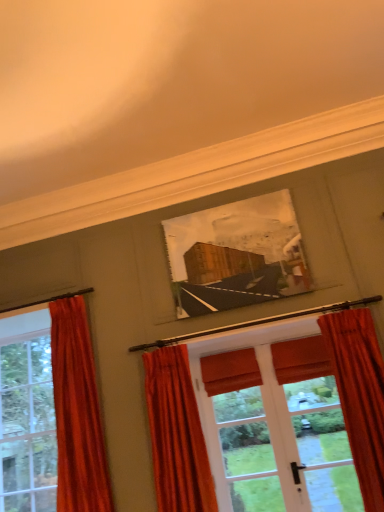
Image resolution: width=384 pixels, height=512 pixels. Describe the element at coordinates (176, 434) in the screenshot. I see `velvet orange curtain at center, which is the 2th curtain from right to left` at that location.

This screenshot has height=512, width=384. I want to click on velvet orange curtain at lower right, the 3th curtain when ordered from left to right, so click(x=359, y=395).

Describe the element at coordinates (77, 412) in the screenshot. I see `velvet red curtain at left, the 1th curtain in the left-to-right sequence` at that location.

Locate an element on the screen. This screenshot has height=512, width=384. wooden picture frame at center is located at coordinates (236, 255).

Do you think matte orange curtain at left is within velvet orange curtain at center, the second curtain viewed from the left, or outside of it?

matte orange curtain at left is spatially situated outside velvet orange curtain at center, the second curtain viewed from the left.

Are matte orange curtain at left and velvet orange curtain at center, which is the 2th curtain from right to left, far apart?

Absolutely, matte orange curtain at left is distant from velvet orange curtain at center, which is the 2th curtain from right to left.

From a real-world perspective, starting from the matte orange curtain at left, which curtain is the 1st one below it? Please provide its 2D coordinates.

[(176, 434)]

Looking at this image, is matte orange curtain at left positioned with its back to velvet orange curtain at center, the second curtain viewed from the left?

No, matte orange curtain at left is not facing away from velvet orange curtain at center, the second curtain viewed from the left.

From the picture: Can you confirm if velvet orange curtain at center, which is the 2th curtain from right to left, is taller than velvet orange curtain at lower right, the 3th curtain when ordered from left to right?

No.

Can you confirm if velvet orange curtain at center, the second curtain viewed from the left, is smaller than velvet orange curtain at lower right, placed as the first curtain when sorted from right to left?

No.

Is velvet orange curtain at lower right, the 3th curtain when ordered from left to right, at the back of velvet orange curtain at center, the second curtain viewed from the left?

No.

Which object is wider, velvet orange curtain at center, the second curtain viewed from the left, or velvet orange curtain at lower right, the 3th curtain when ordered from left to right?

velvet orange curtain at center, the second curtain viewed from the left.

Is velvet orange curtain at lower right, placed as the first curtain when sorted from right to left, taller or shorter than matte orange curtain at left?

In the image, velvet orange curtain at lower right, placed as the first curtain when sorted from right to left, appears to be shorter than matte orange curtain at left.

Considering the relative sizes of velvet orange curtain at lower right, placed as the first curtain when sorted from right to left, and matte orange curtain at left in the image provided, is velvet orange curtain at lower right, placed as the first curtain when sorted from right to left, smaller than matte orange curtain at left?

Yes, velvet orange curtain at lower right, placed as the first curtain when sorted from right to left, is smaller than matte orange curtain at left.

Between velvet orange curtain at lower right, placed as the first curtain when sorted from right to left, and matte orange curtain at left, which one has larger width?

Wider between the two is matte orange curtain at left.

In terms of width, does velvet orange curtain at lower right, placed as the first curtain when sorted from right to left, look wider or thinner when compared to velvet red curtain at left, the 1th curtain in the left-to-right sequence?

Considering their sizes, velvet orange curtain at lower right, placed as the first curtain when sorted from right to left, looks slimmer than velvet red curtain at left, the 1th curtain in the left-to-right sequence.

Relative to velvet red curtain at left, the 3th curtain when ordered from right to left, is velvet orange curtain at lower right, the 3th curtain when ordered from left to right, in front or behind?

In the image, velvet orange curtain at lower right, the 3th curtain when ordered from left to right, appears in front of velvet red curtain at left, the 3th curtain when ordered from right to left.

Which of these two, velvet orange curtain at lower right, the 3th curtain when ordered from left to right, or velvet red curtain at left, the 3th curtain when ordered from right to left, is smaller?

velvet orange curtain at lower right, the 3th curtain when ordered from left to right, is smaller.

Which is further, (x=369, y=409) or (x=63, y=356)?

The point (x=63, y=356) is behind.

Does wooden picture frame at center appear on the left side of matte orange curtain at left?

No, wooden picture frame at center is not to the left of matte orange curtain at left.

Identify the location of window below the wooden picture frame at center (from the image's perspective). The height and width of the screenshot is (512, 384). (27, 424).

Is wooden picture frame at center aimed at matte orange curtain at left?

No, wooden picture frame at center is not oriented towards matte orange curtain at left.

How far apart are wooden picture frame at center and matte orange curtain at left?

wooden picture frame at center is 6.81 feet from matte orange curtain at left.

Can you tell me how much velvet red curtain at left, the 3th curtain when ordered from right to left, and velvet orange curtain at center, the second curtain viewed from the left, differ in facing direction?

There is a 1.2-degree angle between the facing directions of velvet red curtain at left, the 3th curtain when ordered from right to left, and velvet orange curtain at center, the second curtain viewed from the left.

Considering the points (57, 494) and (188, 413), which point is in front, point (57, 494) or point (188, 413)?

Positioned in front is point (188, 413).

In the image, is velvet red curtain at left, the 3th curtain when ordered from right to left, on the left side or the right side of velvet orange curtain at center, which is the 2th curtain from right to left?

Based on their positions, velvet red curtain at left, the 3th curtain when ordered from right to left, is located to the left of velvet orange curtain at center, which is the 2th curtain from right to left.

There is a velvet red curtain at left, the 1th curtain in the left-to-right sequence. Where is `the 1st curtain below it (from a real-world perspective)`? the 1st curtain below it (from a real-world perspective) is located at coordinates (x=176, y=434).

The width and height of the screenshot is (384, 512). Identify the location of curtain that is the 1st one when counting downward from the velvet orange curtain at lower right, placed as the first curtain when sorted from right to left (from the image's perspective). (77, 412).

Is velvet red curtain at left, the 1th curtain in the left-to-right sequence, to the left of velvet orange curtain at lower right, placed as the first curtain when sorted from right to left, from the viewer's perspective?

Correct, you'll find velvet red curtain at left, the 1th curtain in the left-to-right sequence, to the left of velvet orange curtain at lower right, placed as the first curtain when sorted from right to left.

From a real-world perspective, does velvet red curtain at left, the 1th curtain in the left-to-right sequence, sit lower than velvet orange curtain at lower right, placed as the first curtain when sorted from right to left?

No, from a real-world perspective, velvet red curtain at left, the 1th curtain in the left-to-right sequence, is not below velvet orange curtain at lower right, placed as the first curtain when sorted from right to left.

How different are the orientations of velvet red curtain at left, the 3th curtain when ordered from right to left, and velvet orange curtain at lower right, the 3th curtain when ordered from left to right, in degrees?

They differ by 0.419 degrees in their facing directions.

This screenshot has height=512, width=384. I want to click on the 1st curtain positioned below the matte orange curtain at left (from a real-world perspective), so click(x=176, y=434).

Where is `curtain that is the 1st object above the velvet orange curtain at lower right, placed as the first curtain when sorted from right to left (from a real-world perspective)`? This screenshot has height=512, width=384. curtain that is the 1st object above the velvet orange curtain at lower right, placed as the first curtain when sorted from right to left (from a real-world perspective) is located at coordinates (176, 434).

When comparing their distances from velvet orange curtain at center, the second curtain viewed from the left, does velvet orange curtain at lower right, the 3th curtain when ordered from left to right, or wooden picture frame at center seem further?

velvet orange curtain at lower right, the 3th curtain when ordered from left to right, lies further to velvet orange curtain at center, the second curtain viewed from the left, than the other object.

Estimate the real-world distances between objects in this image. Which object is further from velvet red curtain at left, the 1th curtain in the left-to-right sequence, velvet orange curtain at center, which is the 2th curtain from right to left, or wooden picture frame at center?

wooden picture frame at center is further to velvet red curtain at left, the 1th curtain in the left-to-right sequence.

Looking at the image, which one is located closer to velvet orange curtain at lower right, placed as the first curtain when sorted from right to left, matte orange curtain at left or velvet orange curtain at center, the second curtain viewed from the left?

The object closer to velvet orange curtain at lower right, placed as the first curtain when sorted from right to left, is velvet orange curtain at center, the second curtain viewed from the left.

Estimate the real-world distances between objects in this image. Which object is further from velvet orange curtain at center, which is the 2th curtain from right to left, wooden picture frame at center or velvet orange curtain at lower right, the 3th curtain when ordered from left to right?

velvet orange curtain at lower right, the 3th curtain when ordered from left to right, is further to velvet orange curtain at center, which is the 2th curtain from right to left.

Consider the image. Considering their positions, is matte orange curtain at left positioned closer to velvet red curtain at left, the 3th curtain when ordered from right to left, than velvet orange curtain at lower right, the 3th curtain when ordered from left to right?

The object closer to velvet red curtain at left, the 3th curtain when ordered from right to left, is matte orange curtain at left.

From the image, which object appears to be nearer to matte orange curtain at left, velvet red curtain at left, the 1th curtain in the left-to-right sequence, or wooden picture frame at center?

velvet red curtain at left, the 1th curtain in the left-to-right sequence, is positioned closer to the anchor matte orange curtain at left.

Based on their spatial positions, is velvet red curtain at left, the 1th curtain in the left-to-right sequence, or matte orange curtain at left further from velvet orange curtain at center, the second curtain viewed from the left?

The object further to velvet orange curtain at center, the second curtain viewed from the left, is matte orange curtain at left.

From the image, which object appears to be nearer to velvet orange curtain at center, which is the 2th curtain from right to left, velvet orange curtain at lower right, the 3th curtain when ordered from left to right, or matte orange curtain at left?

The object closer to velvet orange curtain at center, which is the 2th curtain from right to left, is velvet orange curtain at lower right, the 3th curtain when ordered from left to right.

Image resolution: width=384 pixels, height=512 pixels. I want to click on picture frame situated between velvet red curtain at left, the 3th curtain when ordered from right to left, and velvet orange curtain at lower right, the 3th curtain when ordered from left to right, from left to right, so click(x=236, y=255).

Locate an element on the screen. picture frame between matte orange curtain at left and velvet orange curtain at lower right, placed as the first curtain when sorted from right to left, from left to right is located at coordinates (236, 255).

You are a GUI agent. You are given a task and a screenshot of the screen. Output one action in this format:
    pyautogui.click(x=<x>, y=<y>)
    Task: Click on the curtain located between velvet red curtain at left, the 3th curtain when ordered from right to left, and velvet orange curtain at lower right, the 3th curtain when ordered from left to right, in the left-right direction
    
    Given the screenshot: What is the action you would take?
    pyautogui.click(x=176, y=434)

Find the location of a particular element. curtain between matte orange curtain at left and velvet orange curtain at center, the second curtain viewed from the left, from left to right is located at coordinates (77, 412).